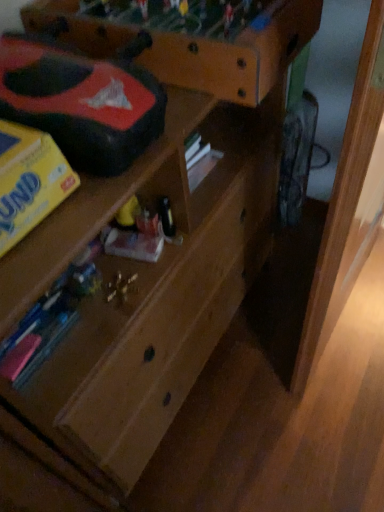
Question: Could you tell me if wooden shelf at upper center is facing rubberized black toy car at upper left?

Choices:
 (A) yes
 (B) no

Answer: (B)

Question: Is the position of wooden shelf at upper center more distant than that of rubberized black toy car at upper left?

Choices:
 (A) yes
 (B) no

Answer: (A)

Question: From a real-world perspective, is wooden shelf at upper center on top of rubberized black toy car at upper left?

Choices:
 (A) yes
 (B) no

Answer: (B)

Question: Is wooden shelf at upper center taller than rubberized black toy car at upper left?

Choices:
 (A) yes
 (B) no

Answer: (A)

Question: Is rubberized black toy car at upper left at the back of wooden shelf at upper center?

Choices:
 (A) no
 (B) yes

Answer: (A)

Question: Considering the relative positions of wooden shelf at upper center and rubberized black toy car at upper left in the image provided, is wooden shelf at upper center in front of rubberized black toy car at upper left?

Choices:
 (A) yes
 (B) no

Answer: (B)

Question: From the image's perspective, is rubberized black toy car at upper left located beneath wooden shelf at upper center?

Choices:
 (A) yes
 (B) no

Answer: (A)

Question: Is rubberized black toy car at upper left to the right of wooden shelf at upper center from the viewer's perspective?

Choices:
 (A) no
 (B) yes

Answer: (A)

Question: Does rubberized black toy car at upper left have a lesser height compared to wooden shelf at upper center?

Choices:
 (A) no
 (B) yes

Answer: (B)

Question: Can you confirm if rubberized black toy car at upper left is smaller than wooden shelf at upper center?

Choices:
 (A) yes
 (B) no

Answer: (A)

Question: Does rubberized black toy car at upper left come in front of wooden shelf at upper center?

Choices:
 (A) yes
 (B) no

Answer: (A)

Question: Does rubberized black toy car at upper left have a greater height compared to wooden shelf at upper center?

Choices:
 (A) no
 (B) yes

Answer: (A)

Question: Looking at the image, does wooden shelf at upper center seem bigger or smaller compared to rubberized black toy car at upper left?

Choices:
 (A) small
 (B) big

Answer: (B)